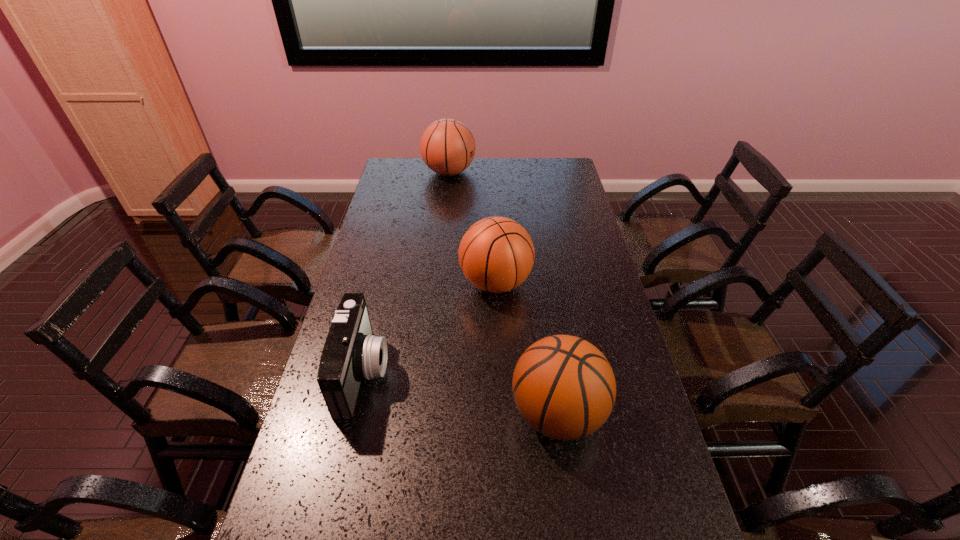
Identify the location of the farthest basketball. (447, 146).

The image size is (960, 540). I want to click on the second farthest object, so click(496, 254).

You are a GUI agent. You are given a task and a screenshot of the screen. Output one action in this format:
    pyautogui.click(x=<x>, y=<y>)
    Task: Click on the nearest basketball
    The image size is (960, 540).
    Given the screenshot: What is the action you would take?
    pyautogui.click(x=564, y=387)

Where is `camcorder`? camcorder is located at coordinates (351, 352).

Where is `free space located 0.300m on the surface of the farthest basketball near the brand logo`? free space located 0.300m on the surface of the farthest basketball near the brand logo is located at coordinates (540, 172).

Find the location of a particular element. This screenshot has height=540, width=960. free space located 0.060m on the right of the second farthest object is located at coordinates (549, 283).

The image size is (960, 540). I want to click on vacant region located on the left of the nearest basketball, so click(x=448, y=413).

Find the location of a particular element. This screenshot has height=540, width=960. vacant region located 0.350m on the lens of the shortest object is located at coordinates (513, 373).

Locate an element on the screen. This screenshot has height=540, width=960. object at the far edge is located at coordinates (447, 146).

Identify the location of object present at the left edge. (351, 352).